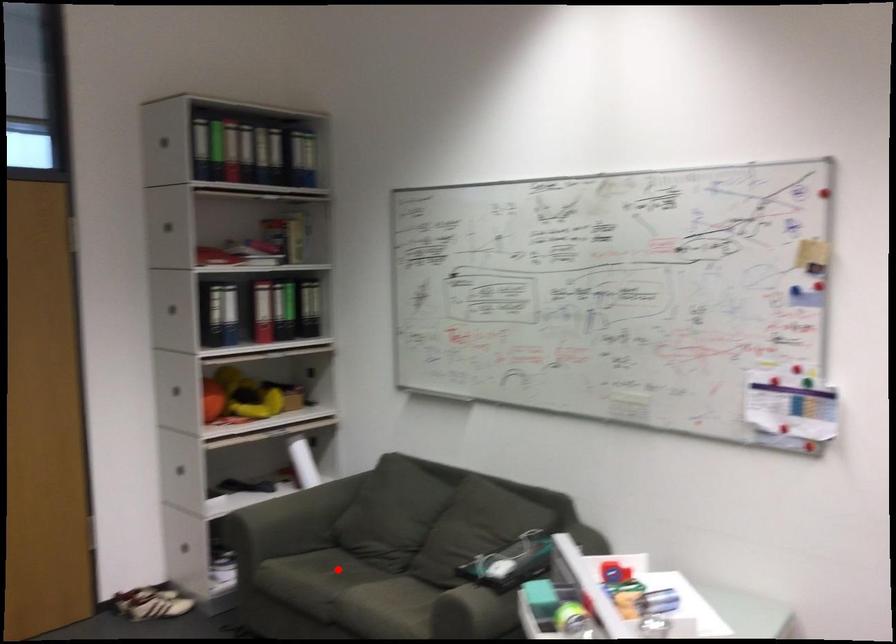
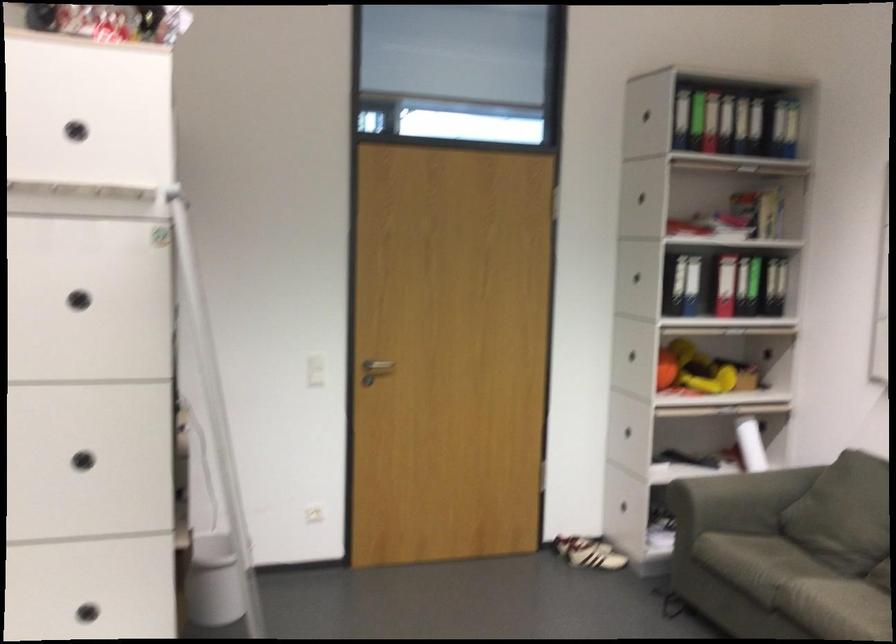
Question: I am providing you with two images of the same scene from different viewpoints. A red point is marked on the first image. At the location where the point appears in image 1, is it still visible in image 2?

Choices:
 (A) Yes
 (B) No

Answer: (A)